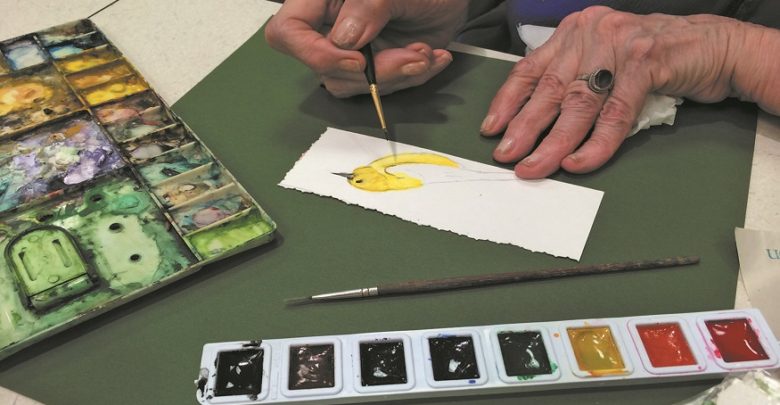
Image resolution: width=780 pixels, height=405 pixels. Identify the location of tissue. (658, 111).